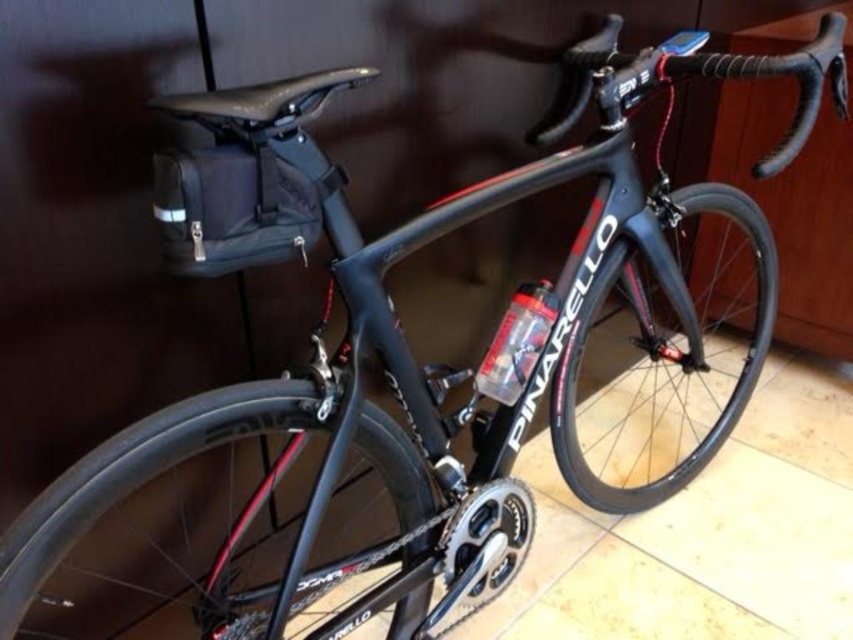
Can you confirm if carbon fiber wheel at center is positioned to the left of shiny black rim at center?

Incorrect, carbon fiber wheel at center is not on the left side of shiny black rim at center.

Is point (703, 269) farther from viewer compared to point (368, 419)?

Yes, it is.

Is point (634, 253) farther from camera compared to point (189, 436)?

Yes.

Locate an element on the screen. carbon fiber wheel at center is located at coordinates (664, 355).